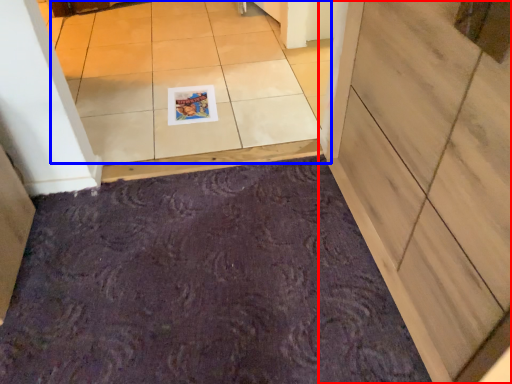
Question: Which object appears closest to the camera in this image, door (highlighted by a red box) or tile (highlighted by a blue box)?

Choices:
 (A) door
 (B) tile

Answer: (A)